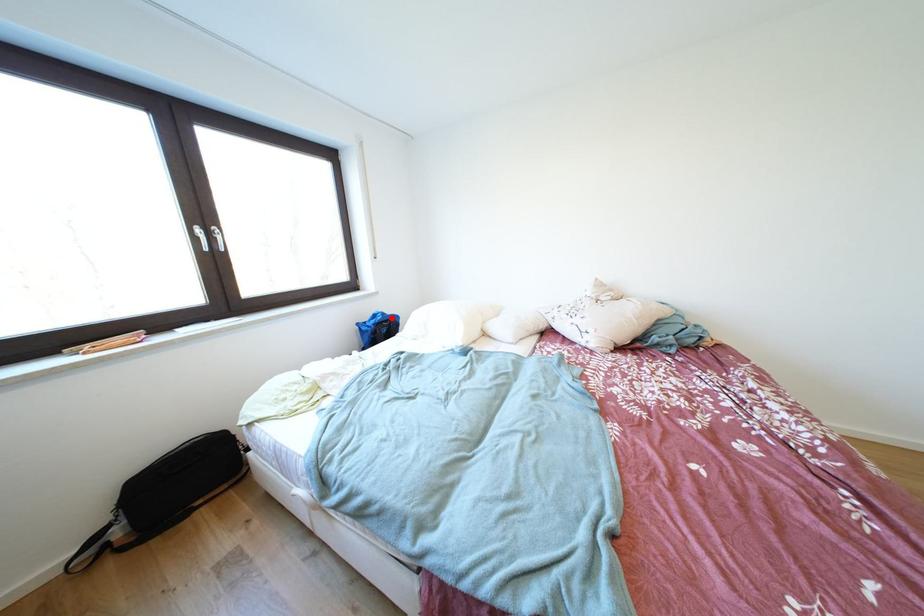
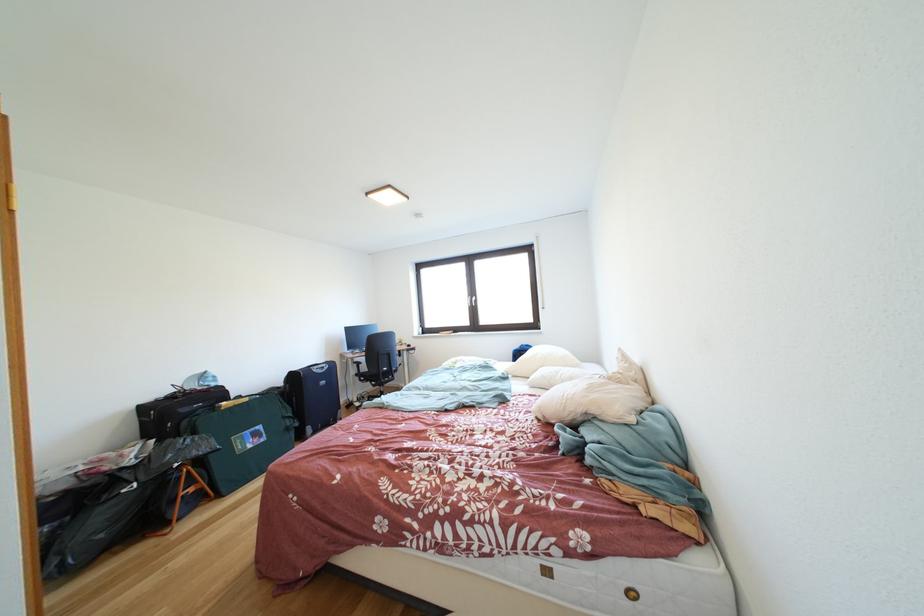
The point at the highlighted location is marked in the first image. Where is the corresponding point in the second image?

(535, 351)